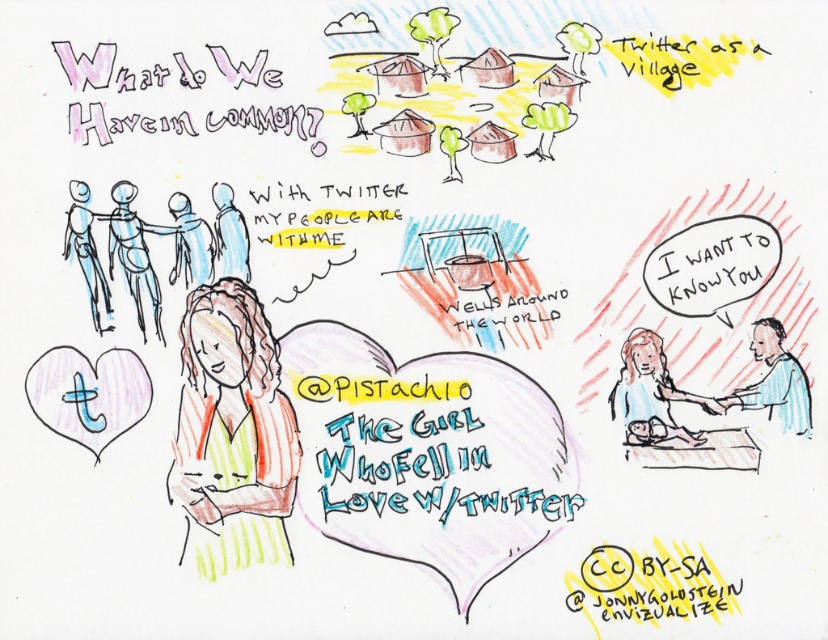
Describe the element at coordinates (774, 380) in the screenshot. I see `blue shirt at right` at that location.

Is blue shirt at right to the right of matte blue figure at upper left from the viewer's perspective?

Yes, blue shirt at right is to the right of matte blue figure at upper left.

What do you see at coordinates (774, 380) in the screenshot? I see `blue shirt at right` at bounding box center [774, 380].

Find the location of a particular element. The height and width of the screenshot is (640, 828). blue shirt at right is located at coordinates (774, 380).

Describe the element at coordinates (88, 394) in the screenshot. The width and height of the screenshot is (828, 640). I see `matte blue heart at lower left` at that location.

Can you confirm if matte blue heart at lower left is positioned to the right of pastel blue dress at center?

In fact, matte blue heart at lower left is to the left of pastel blue dress at center.

Between point (95, 444) and point (668, 392), which one is positioned in front?

Point (95, 444) is more forward.

Identify the location of matte blue heart at lower left. (88, 394).

Is matte blue figure at upper left bigger than blue paper doll at upper center?

Indeed, matte blue figure at upper left has a larger size compared to blue paper doll at upper center.

Is point (190, 209) farther from viewer compared to point (219, 198)?

No, it is in front of (219, 198).

Does point (207, 232) come closer to viewer compared to point (248, 268)?

Yes, point (207, 232) is closer to viewer.

This screenshot has height=640, width=828. I want to click on matte blue figure at upper left, so click(190, 243).